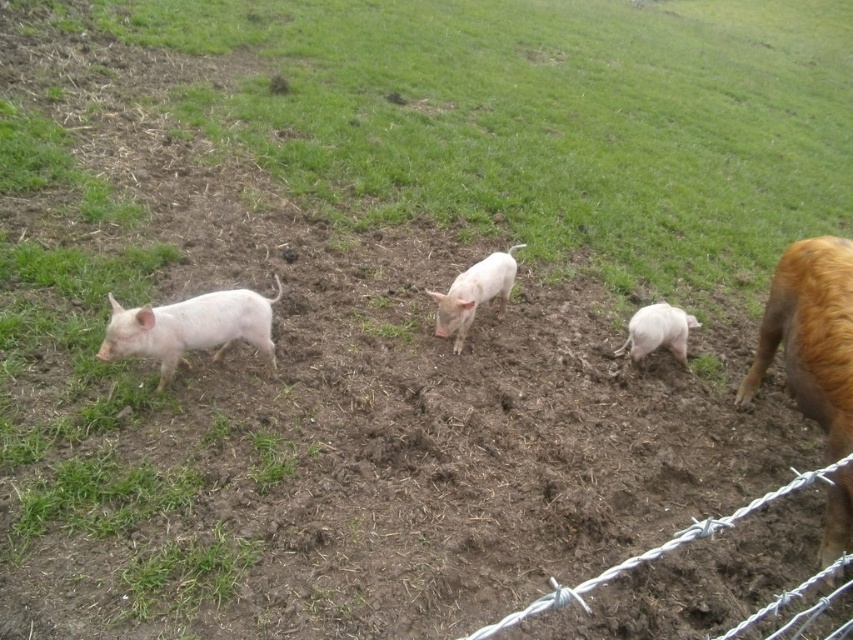
Question: Does pink smooth piglet at center have a greater width compared to pink smooth pig at lower right?

Choices:
 (A) no
 (B) yes

Answer: (B)

Question: Which object appears farthest from the camera in this image?

Choices:
 (A) brown furry pig at right
 (B) barbed wire at lower right
 (C) pink smooth pig at lower right
 (D) pink smooth piglet at center

Answer: (C)

Question: Which of the following is the farthest from the observer?

Choices:
 (A) pink smooth pig at lower right
 (B) brown furry pig at right
 (C) pink smooth piglet at center
 (D) barbed wire at lower right

Answer: (A)

Question: Is pink smooth piglet at center thinner than pink smooth pig at lower right?

Choices:
 (A) no
 (B) yes

Answer: (A)

Question: Can you confirm if pink smooth piglet at left is positioned below pink smooth piglet at center?

Choices:
 (A) no
 (B) yes

Answer: (B)

Question: Among these objects, which one is nearest to the camera?

Choices:
 (A) brown furry pig at right
 (B) barbed wire at lower right

Answer: (B)